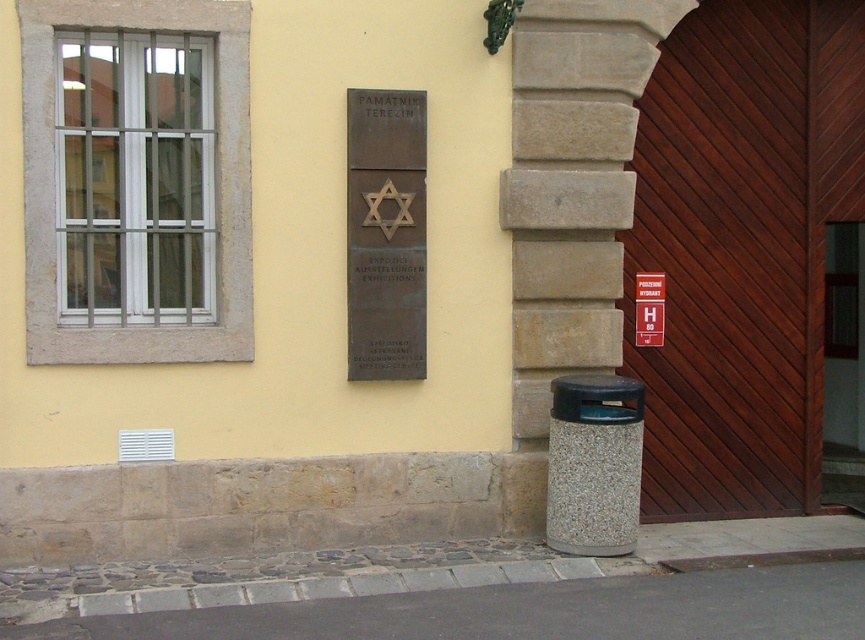
Does dark brown wood door at center right appear over bronze plaque at center?

No.

This screenshot has width=865, height=640. What do you see at coordinates (725, 264) in the screenshot? I see `dark brown wood door at center right` at bounding box center [725, 264].

In order to click on dark brown wood door at center right in this screenshot , I will do coord(725,264).

Who is taller, bronze plaque at center or wooden door at center?

Standing taller between the two is wooden door at center.

Does bronze plaque at center have a larger size compared to wooden door at center?

No, bronze plaque at center is not bigger than wooden door at center.

What do you see at coordinates (386, 234) in the screenshot?
I see `bronze plaque at center` at bounding box center [386, 234].

Identify the location of bronze plaque at center. (386, 234).

Does dark brown wood door at center right appear over wooden door at center?

Indeed, dark brown wood door at center right is positioned over wooden door at center.

Does point (795, 129) lie behind point (857, 449)?

That is False.

The height and width of the screenshot is (640, 865). I want to click on dark brown wood door at center right, so click(x=725, y=264).